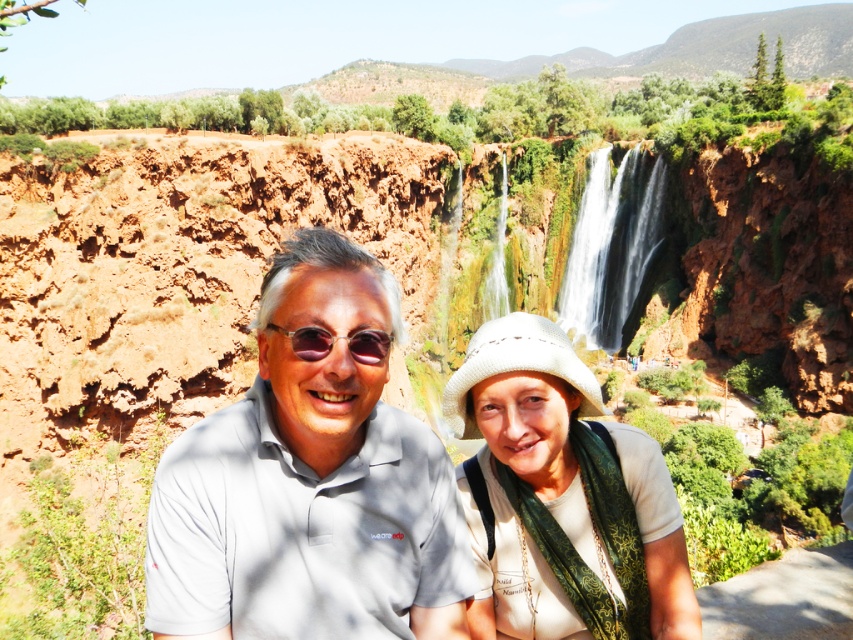
Question: Which object is farther from the camera taking this photo?

Choices:
 (A) white woven hat at center
 (B) white textured waterfall at center
 (C) gray cotton polo shirt at center
 (D) sunglasses at center

Answer: (B)

Question: Which object is farther from the camera taking this photo?

Choices:
 (A) white textured waterfall at center
 (B) gray cotton polo shirt at center
 (C) white woven hat at center

Answer: (A)

Question: Which point appears farthest from the camera in this image?

Choices:
 (A) (450, 552)
 (B) (509, 531)
 (C) (386, 333)
 (D) (637, 280)

Answer: (D)

Question: Does gray cotton polo shirt at center appear under white woven hat at center?

Choices:
 (A) no
 (B) yes

Answer: (A)

Question: Does white textured waterfall at center appear on the left side of sunglasses at center?

Choices:
 (A) no
 (B) yes

Answer: (A)

Question: Is white woven hat at center below white textured waterfall at center?

Choices:
 (A) no
 (B) yes

Answer: (B)